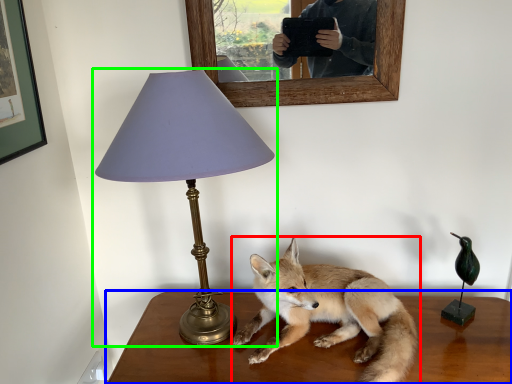
Question: Which object is the closest to the fox (highlighted by a red box)? Choose among these: table (highlighted by a blue box) or lamp (highlighted by a green box).

Choices:
 (A) table
 (B) lamp

Answer: (A)